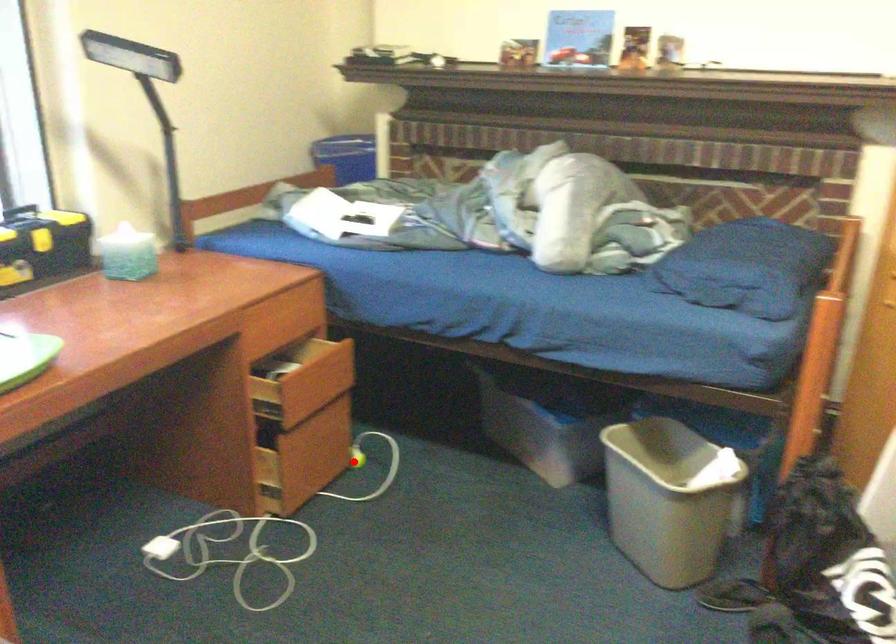
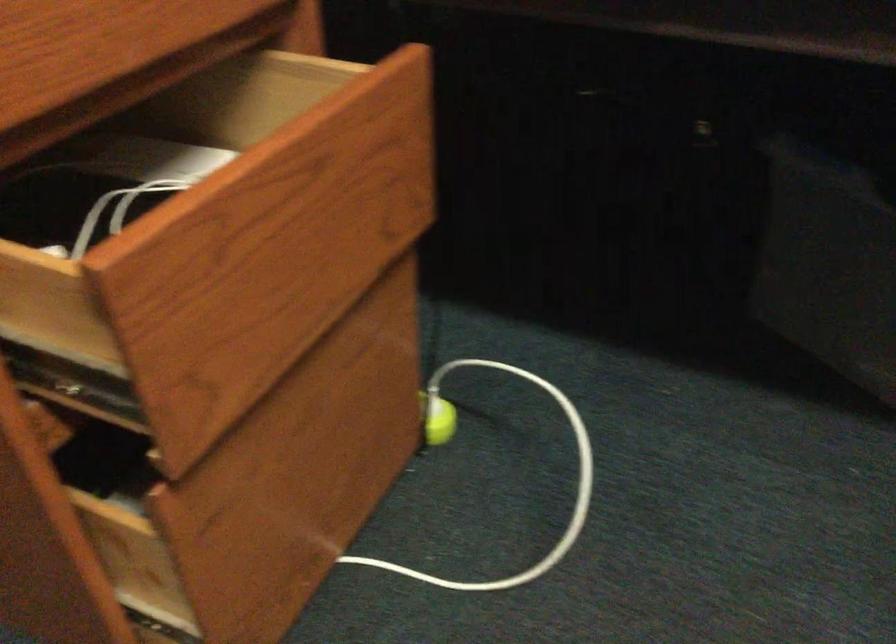
Where in the second image is the point corresponding to the highlighted location from the first image?

(437, 420)